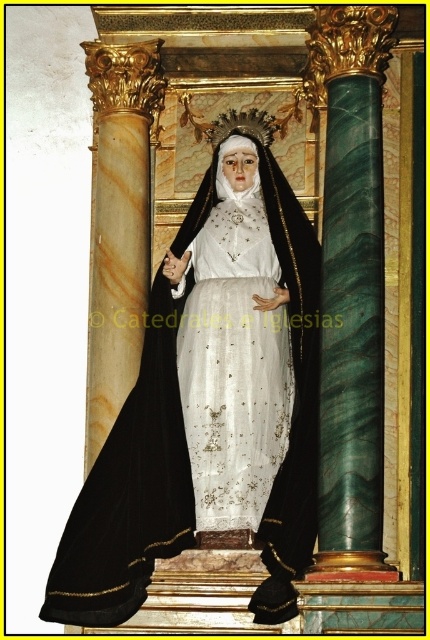
Can you confirm if black velvet cloak at center is positioned below white satin dress at center?

Correct, black velvet cloak at center is located below white satin dress at center.

Between point (270, 513) and point (224, 348), which one is positioned in front?

Positioned in front is point (270, 513).

What do you see at coordinates (211, 404) in the screenshot? I see `black velvet cloak at center` at bounding box center [211, 404].

Image resolution: width=430 pixels, height=640 pixels. Identify the location of black velvet cloak at center. (211, 404).